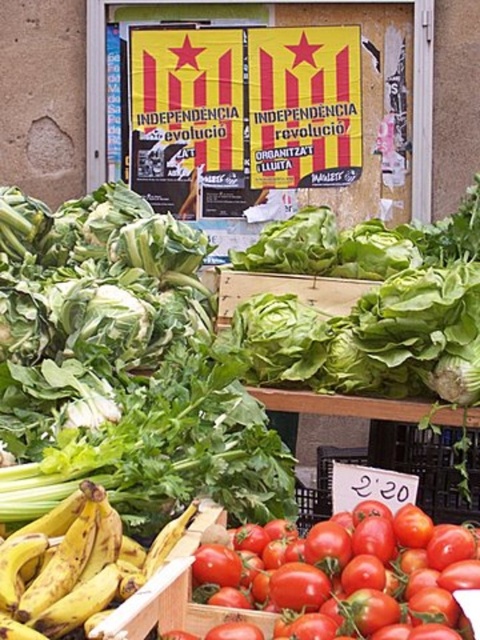
Question: Which of these objects is positioned closest to the shiny red tomato at lower center?

Choices:
 (A) yellow matte bananas at lower left
 (B) yellowstriped fabricposter at upper center

Answer: (A)

Question: Is yellowstriped fabricposter at upper center positioned at the back of shiny red tomato at lower center?

Choices:
 (A) no
 (B) yes

Answer: (B)

Question: Which of the following is the farthest from the observer?

Choices:
 (A) yellowstriped fabricposter at upper center
 (B) shiny red tomato at lower center

Answer: (A)

Question: Which of the following is the farthest from the observer?

Choices:
 (A) shiny red tomato at lower center
 (B) yellow matte bananas at lower left
 (C) yellowstriped fabricposter at upper center

Answer: (C)

Question: Does shiny red tomato at lower center appear over yellow matte bananas at lower left?

Choices:
 (A) no
 (B) yes

Answer: (A)

Question: Is yellowstriped fabricposter at upper center thinner than shiny red tomato at lower center?

Choices:
 (A) yes
 (B) no

Answer: (B)